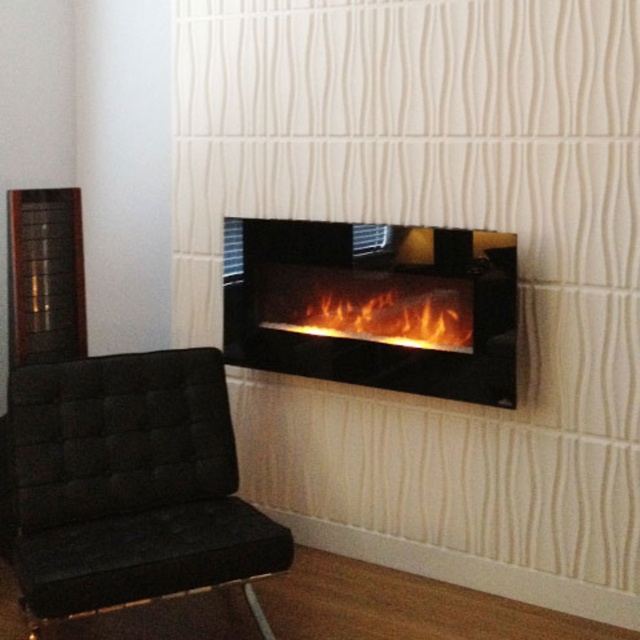
You are standing in a room with a black glass fireplace at center and a black armchair with woven fabric to its left. A point marked at coordinates (372, 305) is shown. Which object does this point correspond to?

The point at coordinates (372, 305) corresponds to the black glass fireplace at center.

You are standing in the living room and want to move from the entrance to the black glass fireplace at center. There is a black fabric armchair at left in your path. Can you walk around the chair to reach the fireplace?

Yes, you can walk around the black fabric armchair at left to reach the black glass fireplace at center because the armchair is positioned to the left of the fireplace, allowing a clear path around it.

You are standing in a room with a modern interior. There is a sleek black electric fireplace mounted on a textured wall and a black armchair to the left of the fireplace. A point in the room is located at coordinates point (433,339). If you want to place a small table at this point, will it be within your reach from your current position?

The distance of point (433,339) from viewer is 2.46 meters. Since the average comfortable reaching distance for most people is around 1.5 to 2 meters, placing the table at this point might be slightly out of reach unless you take a step forward.